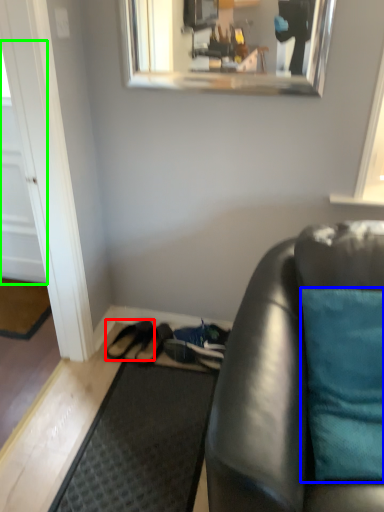
Question: Considering the real-world distances, which object is farthest from footwear (highlighted by a red box)? pillow (highlighted by a blue box) or door (highlighted by a green box)?

Choices:
 (A) pillow
 (B) door

Answer: (A)